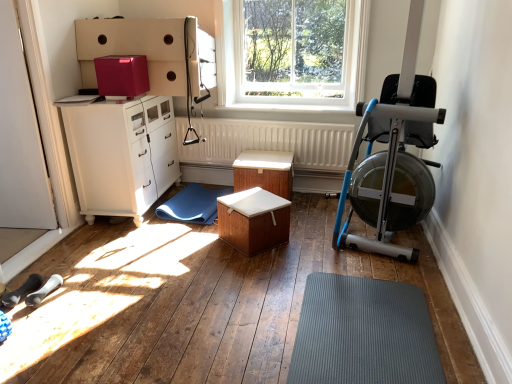
The height and width of the screenshot is (384, 512). I want to click on free space above clear glass window at upper center (from a real-world perspective), so click(281, 0).